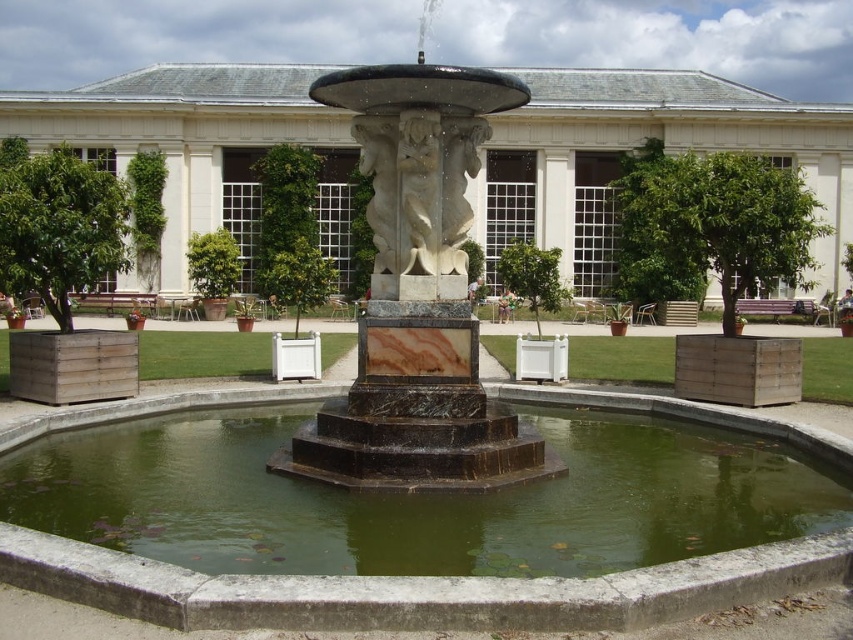
You are a landscape architect designing a new garden. You want to ensure that visitors can clearly see both the white marble fountain at center and the green marble water at center. Based on their positions, which one should be placed higher to achieve this?

The white marble fountain at center is already positioned above the green marble water at center, so maintaining this arrangement ensures both elements are visible as the fountain is elevated over the water.

You are a landscape architect designing a new garden layout. You need to ensure that the green marble water at center and the marble statue at center are positioned correctly according to the existing design. Based on the scene description, which object is located lower in the vertical arrangement?

The green marble water at center is positioned below the marble statue at center, so it is lower in the vertical arrangement.

You are standing in the garden and want to know if the green marble water at center can be seen above the marble statue at center. Based on the scene description, can you determine this?

The green marble water at center is not as tall as the marble statue at center, so it cannot be seen above the marble statue at center.